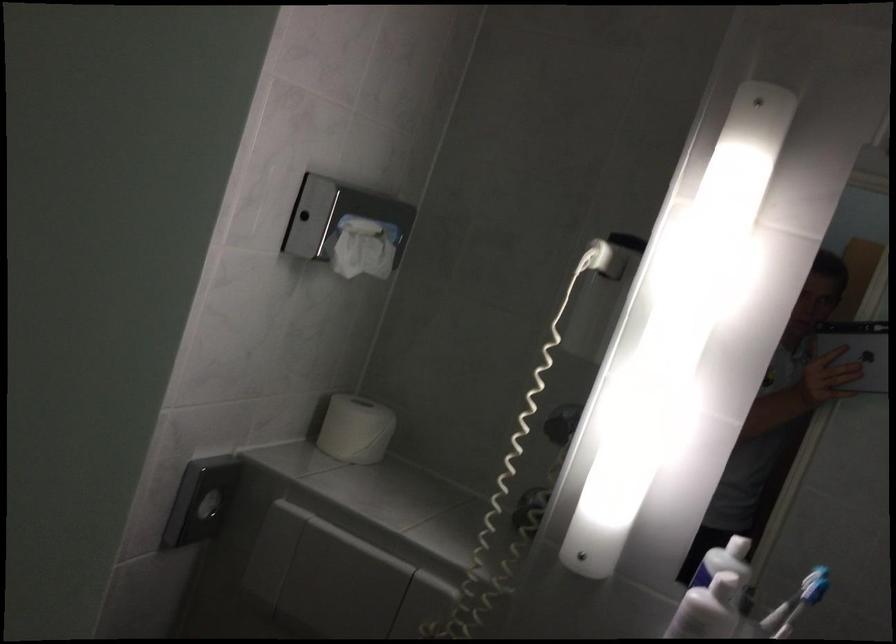
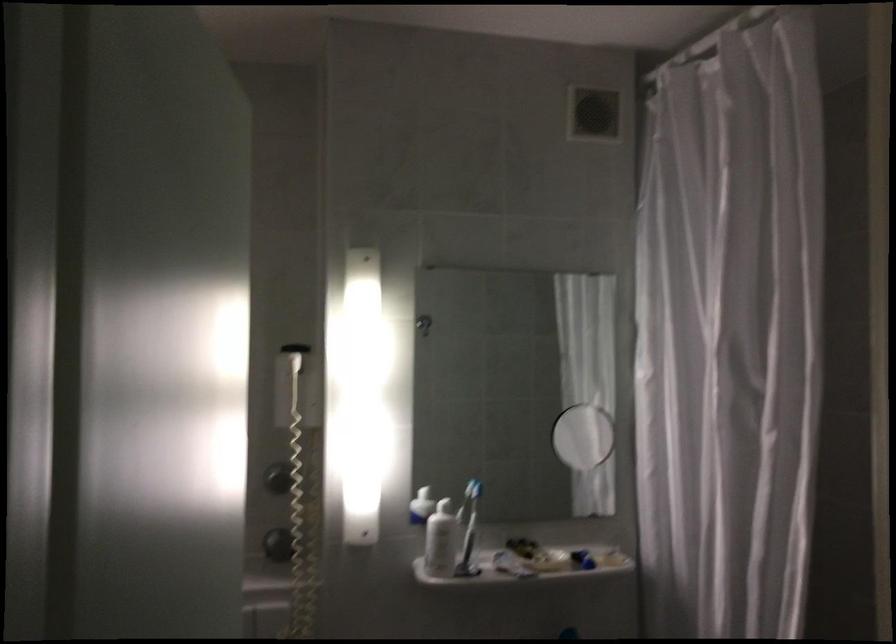
In the second image, find the point that corresponds to (x=605, y=308) in the first image.

(295, 386)